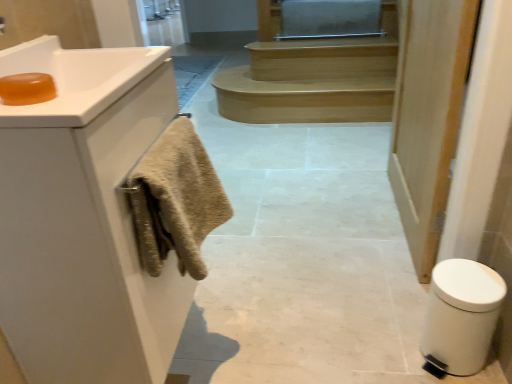
Question: Is beige textured towel at left taller than white matte door at right?

Choices:
 (A) no
 (B) yes

Answer: (A)

Question: From the image's perspective, is beige textured towel at left located above white matte door at right?

Choices:
 (A) no
 (B) yes

Answer: (A)

Question: From the image's perspective, is beige textured towel at left below white matte door at right?

Choices:
 (A) no
 (B) yes

Answer: (B)

Question: Is beige textured towel at left shorter than white matte door at right?

Choices:
 (A) yes
 (B) no

Answer: (A)

Question: Considering the relative sizes of beige textured towel at left and white matte door at right in the image provided, is beige textured towel at left thinner than white matte door at right?

Choices:
 (A) yes
 (B) no

Answer: (B)

Question: Based on their positions, is beige textured towel at left located to the left or right of translucent amber soap at upper left?

Choices:
 (A) left
 (B) right

Answer: (B)

Question: Considering the positions of point (214, 221) and point (15, 77), is point (214, 221) closer or farther from the camera than point (15, 77)?

Choices:
 (A) farther
 (B) closer

Answer: (A)

Question: In the image, is beige textured towel at left positioned in front of or behind translucent amber soap at upper left?

Choices:
 (A) front
 (B) behind

Answer: (B)

Question: Considering the positions of beige textured towel at left and translucent amber soap at upper left in the image, is beige textured towel at left taller or shorter than translucent amber soap at upper left?

Choices:
 (A) short
 (B) tall

Answer: (B)

Question: Considering the positions of point (230, 87) and point (4, 102), is point (230, 87) closer or farther from the camera than point (4, 102)?

Choices:
 (A) farther
 (B) closer

Answer: (A)

Question: From the image's perspective, is light brown wood stairs at center positioned above or below translucent amber soap at upper left?

Choices:
 (A) below
 (B) above

Answer: (B)

Question: In the image, is light brown wood stairs at center on the left side or the right side of translucent amber soap at upper left?

Choices:
 (A) left
 (B) right

Answer: (B)

Question: Is light brown wood stairs at center inside the boundaries of translucent amber soap at upper left, or outside?

Choices:
 (A) outside
 (B) inside

Answer: (A)

Question: Is point (14, 104) closer or farther from the camera than point (437, 334)?

Choices:
 (A) farther
 (B) closer

Answer: (B)

Question: Looking at the image, does translucent amber soap at upper left seem bigger or smaller compared to white plastic bidet at lower right?

Choices:
 (A) small
 (B) big

Answer: (A)